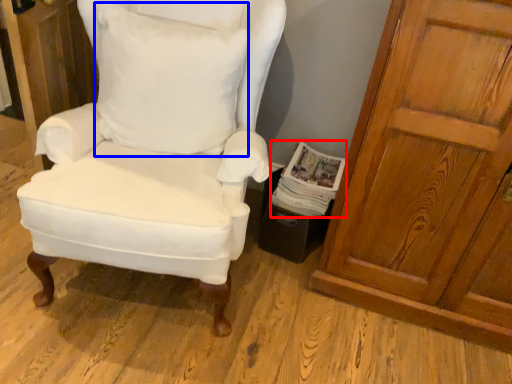
Question: Which point is further to the camera, magazine (highlighted by a red box) or pillow (highlighted by a blue box)?

Choices:
 (A) magazine
 (B) pillow

Answer: (A)